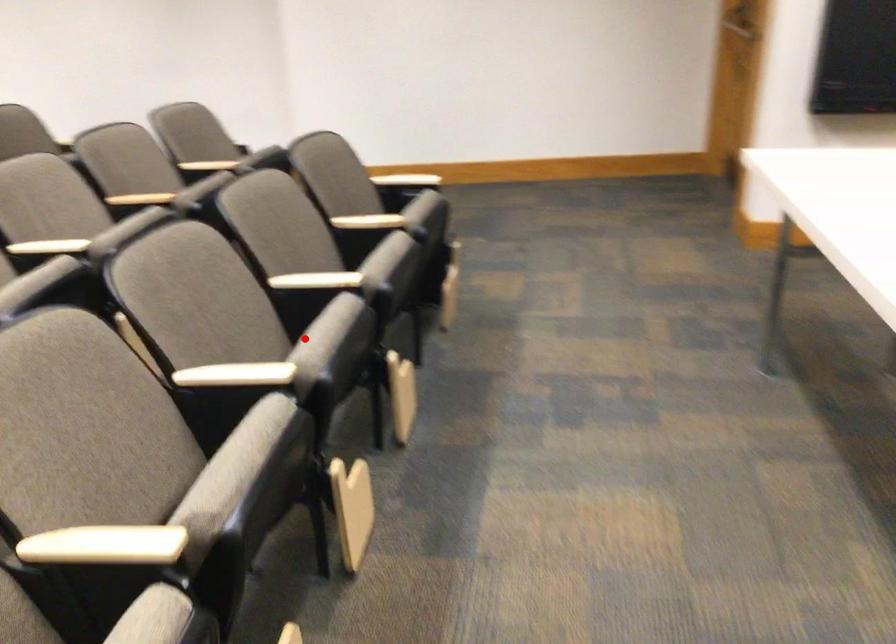
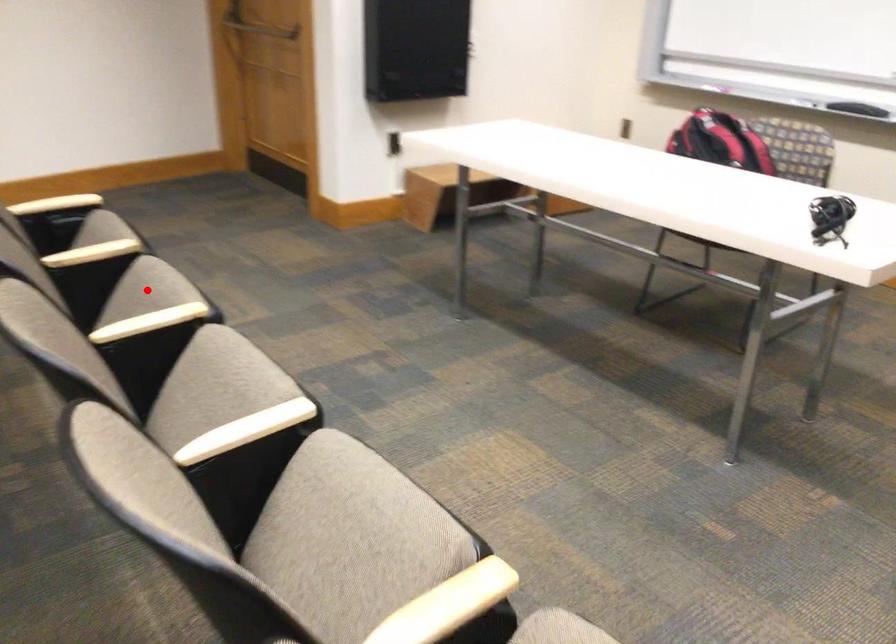
I am providing you with two images of the same scene from different viewpoints. A red point is marked on the first image and another point is marked on the second image. Does the point marked in image1 correspond to the same location as the one in image2?

No